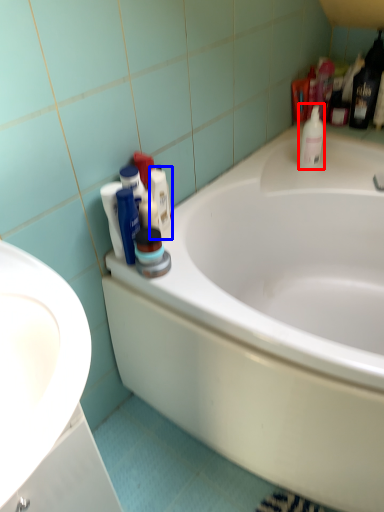
Question: Among these objects, which one is farthest to the camera, cleaning product (highlighted by a red box) or toiletry (highlighted by a blue box)?

Choices:
 (A) cleaning product
 (B) toiletry

Answer: (A)